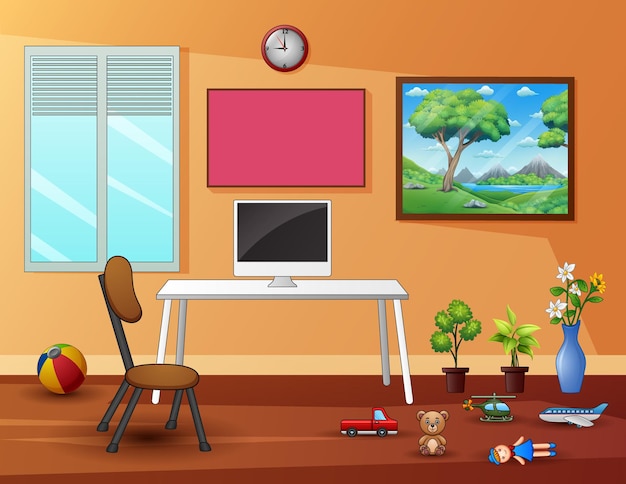
Image resolution: width=626 pixels, height=484 pixels. Identify the location of chair. (165, 379).